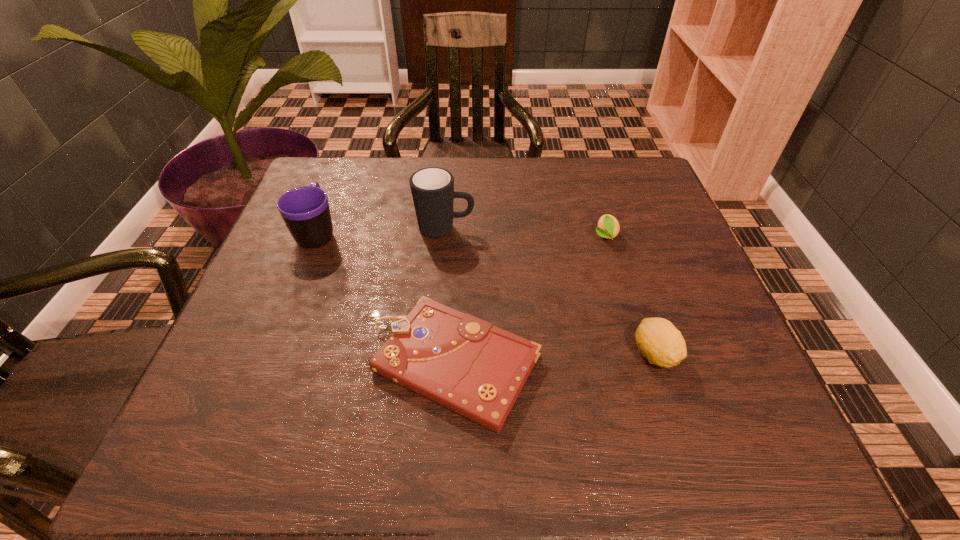
Image resolution: width=960 pixels, height=540 pixels. Find the location of `vacant space at the left edge of the desktop`. vacant space at the left edge of the desktop is located at coordinates (267, 289).

In the image, there is a desktop. Where is `vacant space at the right edge`? The image size is (960, 540). vacant space at the right edge is located at coordinates (667, 255).

The image size is (960, 540). I want to click on vacant space at the far left corner of the desktop, so click(x=367, y=159).

Image resolution: width=960 pixels, height=540 pixels. What are the coordinates of `free space at the near left corner` in the screenshot? It's located at (246, 446).

Identify the location of free space between the shortest object and the tallest object. The height and width of the screenshot is (540, 960). (450, 296).

Identify the location of vacant area that lies between the second tallest object and the notebook. The image size is (960, 540). (387, 298).

Locate an element on the screen. The image size is (960, 540). empty space between the taller lemon and the shortest object is located at coordinates (555, 359).

The width and height of the screenshot is (960, 540). I want to click on free area in between the right mug and the nearer lemon, so click(550, 291).

Where is `vacant area between the right mug and the shorter lemon`? This screenshot has height=540, width=960. vacant area between the right mug and the shorter lemon is located at coordinates (525, 232).

Image resolution: width=960 pixels, height=540 pixels. Find the location of `unoccupied area between the third tallest object and the shorter lemon`. unoccupied area between the third tallest object and the shorter lemon is located at coordinates (630, 294).